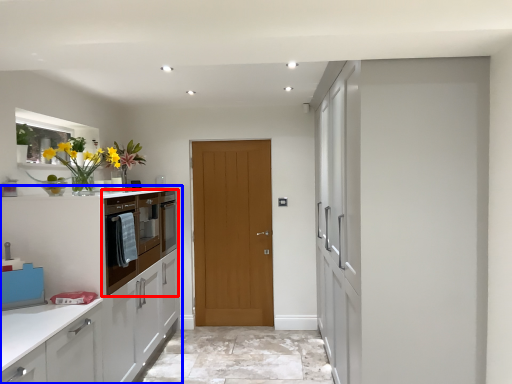
Question: Which object is further to the camera taking this photo, cabinetry (highlighted by a red box) or cabinetry (highlighted by a blue box)?

Choices:
 (A) cabinetry
 (B) cabinetry

Answer: (A)